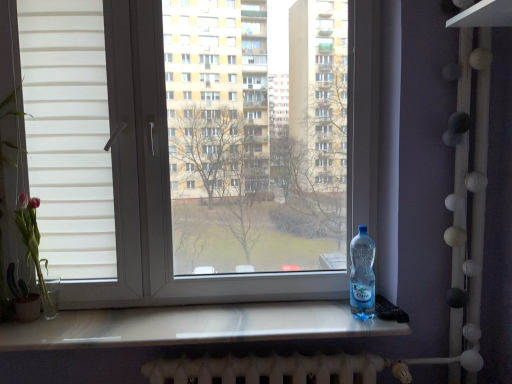
Question: Is transparent plastic window at center further to camera compared to transparent plastic bottle at right?

Choices:
 (A) yes
 (B) no

Answer: (B)

Question: Is transparent plastic window at center next to transparent plastic bottle at right?

Choices:
 (A) no
 (B) yes

Answer: (A)

Question: Is transparent plastic window at center looking in the opposite direction of transparent plastic bottle at right?

Choices:
 (A) yes
 (B) no

Answer: (A)

Question: Considering the relative sizes of transparent plastic window at center and transparent plastic bottle at right in the image provided, is transparent plastic window at center shorter than transparent plastic bottle at right?

Choices:
 (A) no
 (B) yes

Answer: (A)

Question: Considering the relative positions of transparent plastic window at center and transparent plastic bottle at right in the image provided, is transparent plastic window at center to the left of transparent plastic bottle at right from the viewer's perspective?

Choices:
 (A) no
 (B) yes

Answer: (B)

Question: Considering the positions of transparent plastic window at center and pink glass vase at left in the image, is transparent plastic window at center taller or shorter than pink glass vase at left?

Choices:
 (A) short
 (B) tall

Answer: (B)

Question: Visually, is transparent plastic window at center positioned to the left or to the right of pink glass vase at left?

Choices:
 (A) left
 (B) right

Answer: (B)

Question: In terms of size, does transparent plastic window at center appear bigger or smaller than pink glass vase at left?

Choices:
 (A) big
 (B) small

Answer: (A)

Question: Is transparent plastic window at center spatially inside pink glass vase at left, or outside of it?

Choices:
 (A) outside
 (B) inside

Answer: (A)

Question: Is pink glass vase at left wider or thinner than transparent plastic bottle at right?

Choices:
 (A) thin
 (B) wide

Answer: (A)

Question: From a real-world perspective, is pink glass vase at left positioned above or below transparent plastic bottle at right?

Choices:
 (A) below
 (B) above

Answer: (B)

Question: Is pink glass vase at left taller or shorter than transparent plastic bottle at right?

Choices:
 (A) tall
 (B) short

Answer: (A)

Question: Is pink glass vase at left in front of or behind transparent plastic bottle at right in the image?

Choices:
 (A) behind
 (B) front

Answer: (A)

Question: Based on their sizes in the image, would you say pink glass vase at left is bigger or smaller than transparent plastic window at center?

Choices:
 (A) big
 (B) small

Answer: (B)

Question: Does point (46, 289) appear closer or farther from the camera than point (128, 223)?

Choices:
 (A) farther
 (B) closer

Answer: (A)